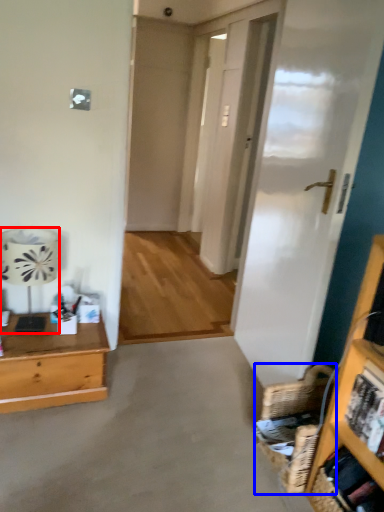
Question: Which point is further to the camera, lamp (highlighted by a red box) or basket (highlighted by a blue box)?

Choices:
 (A) lamp
 (B) basket

Answer: (A)